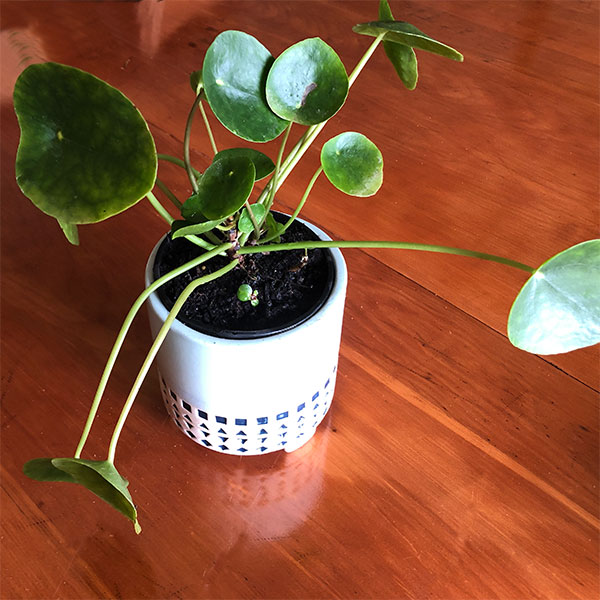
Identify the location of light wood grain. The image size is (600, 600). (454, 430).